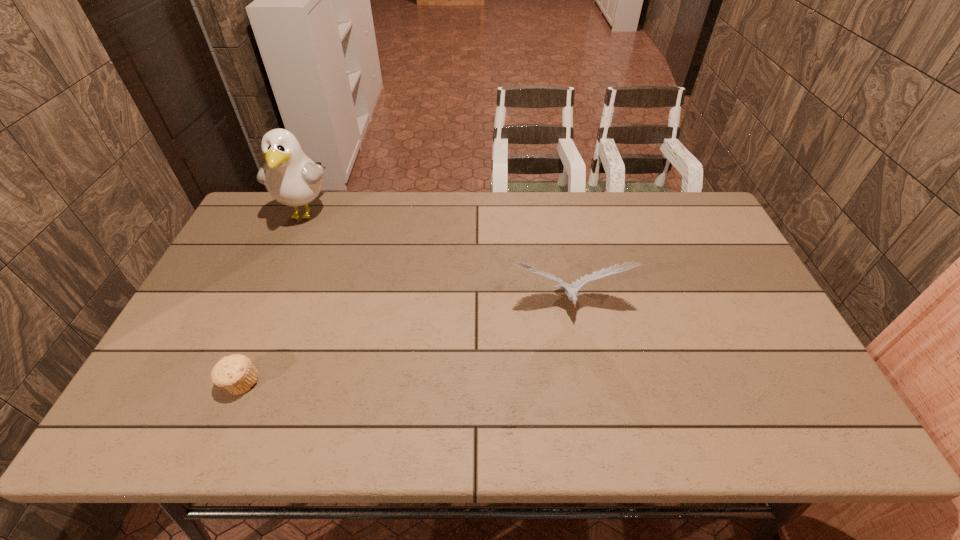
You are a GUI agent. You are given a task and a screenshot of the screen. Output one action in this format:
    pyautogui.click(x=<x>, y=<y>)
    Task: Click on the vacant space that's between the shortest object and the second farthest object
    
    Given the screenshot: What is the action you would take?
    pyautogui.click(x=404, y=344)

Locate an element on the screen. This screenshot has height=540, width=960. vacant area between the right gull and the nearest object is located at coordinates (404, 344).

Where is `free space between the rightmost object and the shortest object`? The height and width of the screenshot is (540, 960). free space between the rightmost object and the shortest object is located at coordinates (404, 344).

Identify the location of free spot between the rightmost object and the muffin. The height and width of the screenshot is (540, 960). (404, 344).

The image size is (960, 540). In order to click on unoccupied area between the left gull and the nearest object in this screenshot , I will do `click(274, 298)`.

Locate an element on the screen. vacant point located between the right gull and the muffin is located at coordinates [404, 344].

Find the location of a particular element. This screenshot has height=540, width=960. free spot between the nearest object and the nearer gull is located at coordinates (404, 344).

The width and height of the screenshot is (960, 540). What are the coordinates of `unoccupied position between the shortest object and the nearer gull` in the screenshot? It's located at (404, 344).

In order to click on empty space that is in between the left gull and the nearer gull in this screenshot , I will do `click(437, 259)`.

Identify which object is the closest to the muffin. Please provide its 2D coordinates. Your answer should be formatted as a tuple, i.e. [(x, y)], where the tuple contains the x and y coordinates of a point satisfying the conditions above.

[(292, 178)]